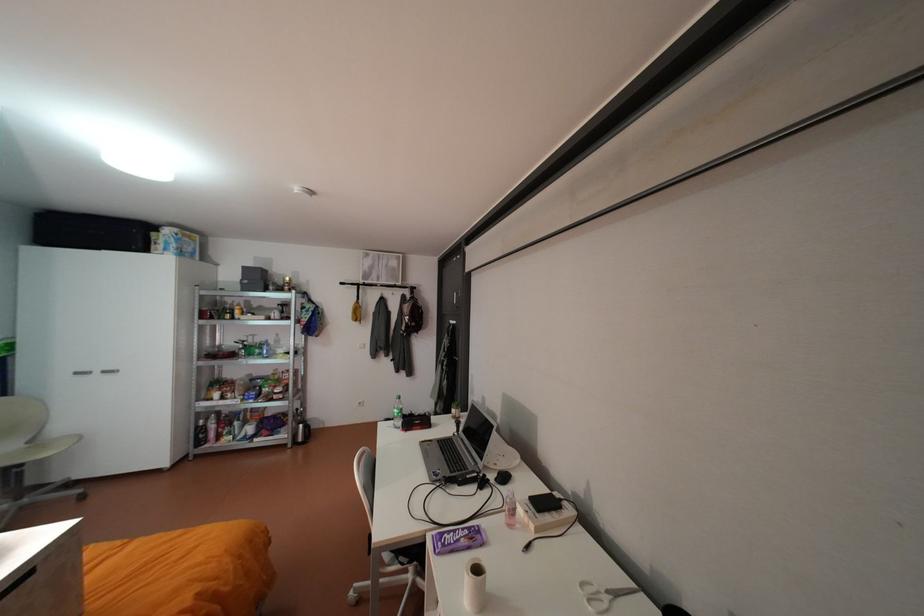
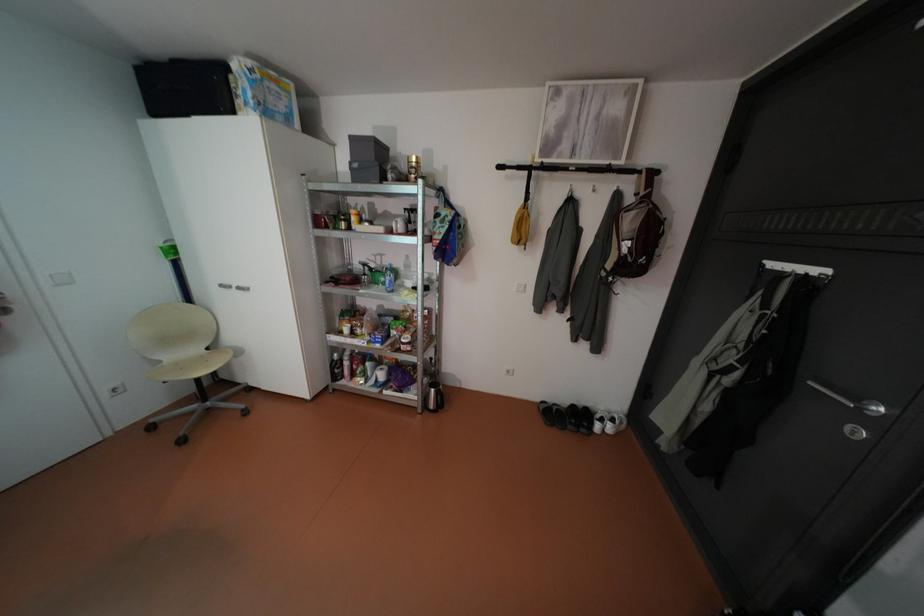
Locate, in the second image, the point that corresponds to pixel 258 354 in the first image.

(383, 282)